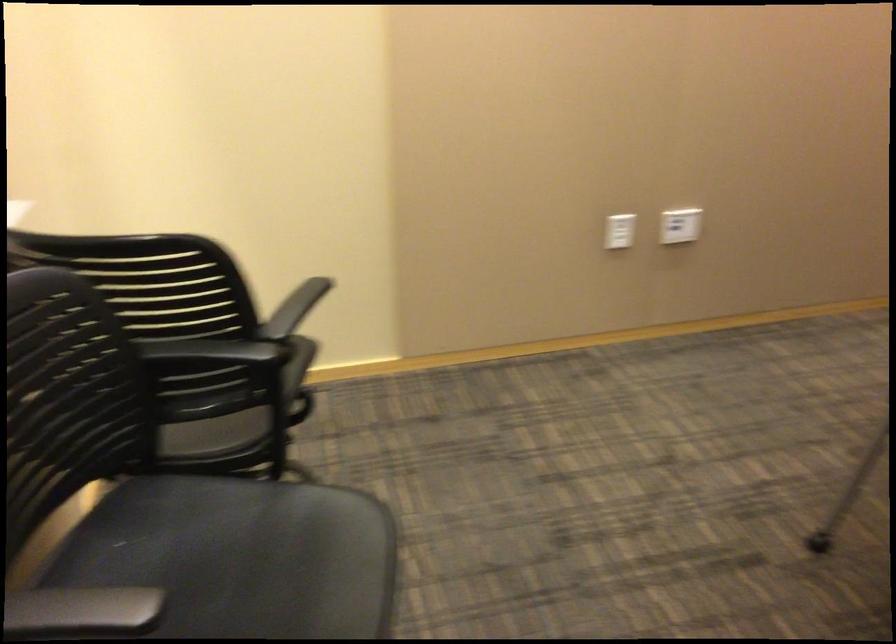
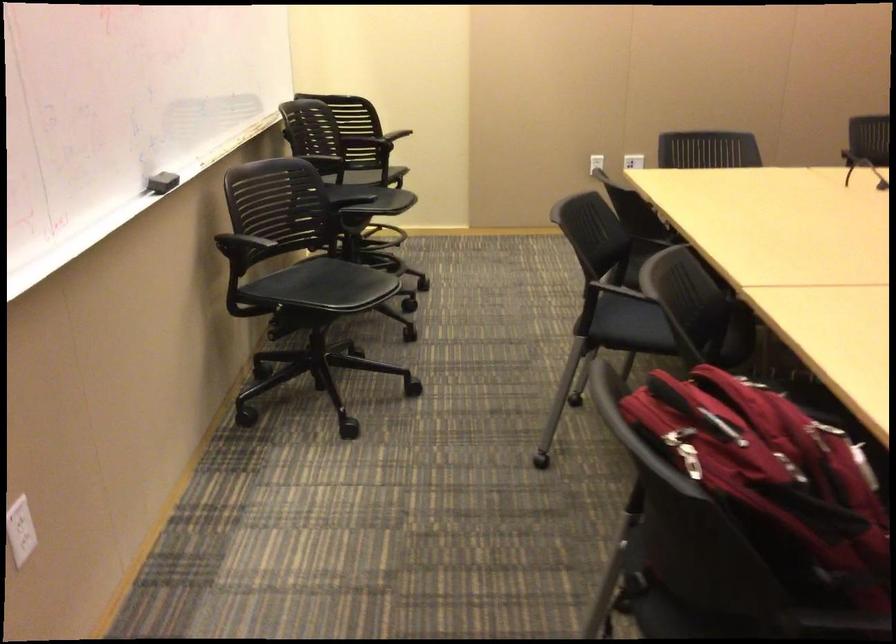
Which direction would the cameraman need to move to produce the second image?

The movement direction of the cameraman is right, backward.